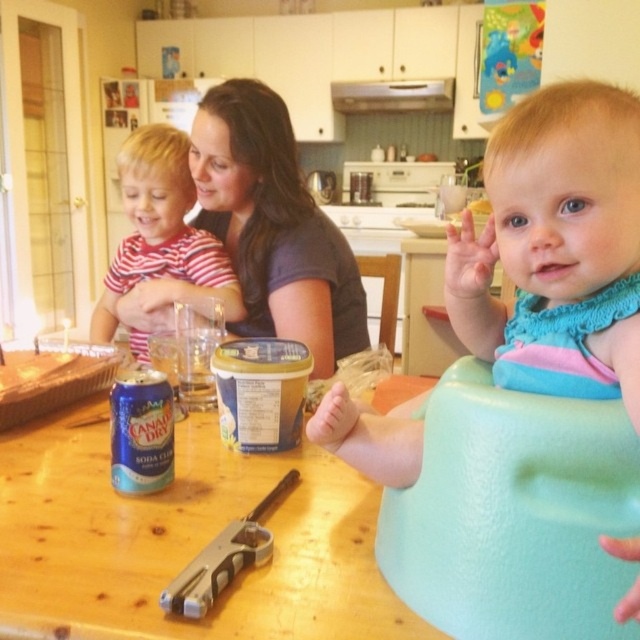
Question: Which of the following is the farthest from the observer?

Choices:
 (A) (502, 205)
 (B) (358, 577)
 (C) (218, 544)

Answer: (C)

Question: Is wooden table at center positioned at the back of matte striped shirt at center?

Choices:
 (A) yes
 (B) no

Answer: (B)

Question: Which point is farther to the camera?

Choices:
 (A) (x=221, y=205)
 (B) (x=138, y=220)
 (C) (x=360, y=259)
 (D) (x=243, y=541)

Answer: (C)

Question: Which of the following is the closest to the observer?

Choices:
 (A) (378, 323)
 (B) (336, 282)
 (C) (280, 486)
 (D) (330, 412)

Answer: (D)

Question: Does matte striped shirt at center have a lesser width compared to silver metallic toy gun at center?

Choices:
 (A) no
 (B) yes

Answer: (A)

Question: In this image, where is matte striped shirt at center located relative to silver metallic toy gun at center?

Choices:
 (A) below
 (B) above

Answer: (B)